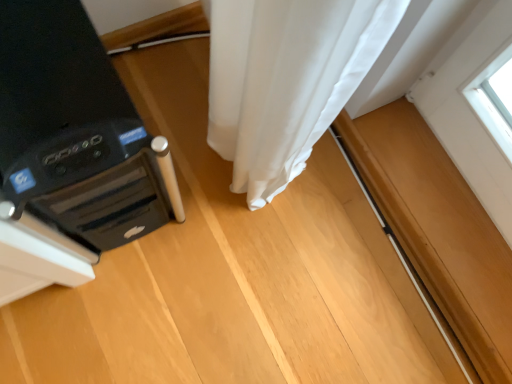
Locate an element on the screen. This screenshot has width=512, height=384. vacant area that lies to the right of black plastic speaker at left is located at coordinates (226, 223).